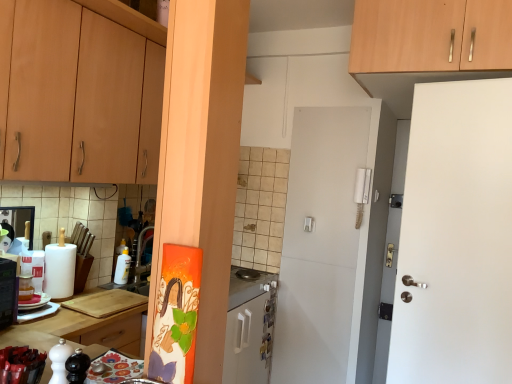
Question: Which is correct: wooden cabinet at upper right, the 1th cabinetry viewed from the right, is inside white plastic salt shaker at lower left, or outside of it?

Choices:
 (A) outside
 (B) inside

Answer: (A)

Question: In terms of height, does wooden cabinet at upper right, which is the 2th cabinetry from left to right, look taller or shorter compared to white plastic salt shaker at lower left?

Choices:
 (A) short
 (B) tall

Answer: (B)

Question: Which object is the closest to the stainless steel gas stove at center?

Choices:
 (A) wooden cabinet at upper left, which appears as the second cabinetry when viewed from the right
 (B) white plastic salt shaker at lower left
 (C) white paper towel at left, which is counted as the 1th appliance, starting from the left
 (D) wooden cutting board at lower center
 (E) wooden cutting board at lower left

Answer: (D)

Question: Based on their relative distances, which object is nearer to the wooden cabinet at upper right, which is the 2th cabinetry from left to right?

Choices:
 (A) wooden cutting board at lower left
 (B) white paper towel at left, which is counted as the 1th appliance, starting from the left
 (C) white plastic bottle at center, which appears as the second appliance when viewed from the left
 (D) wooden cabinet at upper left, which appears as the second cabinetry when viewed from the right
 (E) stainless steel gas stove at center

Answer: (D)